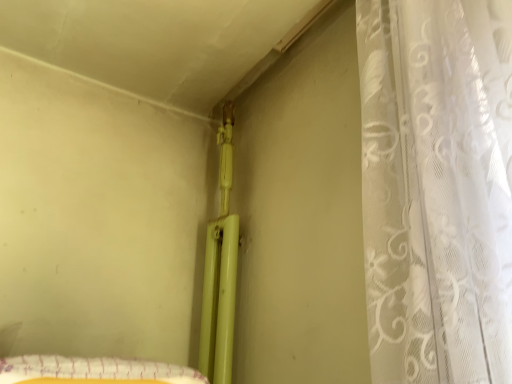
Question: In terms of size, does white sheer curtain at right appear bigger or smaller than yellow fabric at lower left?

Choices:
 (A) big
 (B) small

Answer: (A)

Question: From a real-world perspective, is white sheer curtain at right above or below yellow fabric at lower left?

Choices:
 (A) below
 (B) above

Answer: (B)

Question: In the image, is white sheer curtain at right positioned in front of or behind yellow fabric at lower left?

Choices:
 (A) behind
 (B) front

Answer: (B)

Question: Considering their positions, is yellow fabric at lower left located in front of or behind white sheer curtain at right?

Choices:
 (A) front
 (B) behind

Answer: (B)

Question: Choose the correct answer: Is yellow fabric at lower left inside white sheer curtain at right or outside it?

Choices:
 (A) inside
 (B) outside

Answer: (B)

Question: Considering the positions of yellow fabric at lower left and white sheer curtain at right in the image, is yellow fabric at lower left bigger or smaller than white sheer curtain at right?

Choices:
 (A) small
 (B) big

Answer: (A)

Question: Is yellow fabric at lower left taller or shorter than white sheer curtain at right?

Choices:
 (A) short
 (B) tall

Answer: (A)